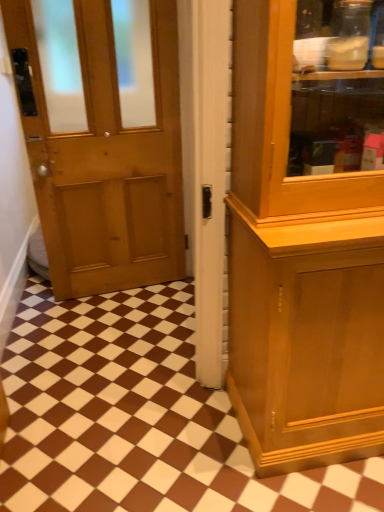
Find the location of a particular element. vacant location behind matte wood door at center is located at coordinates (119, 341).